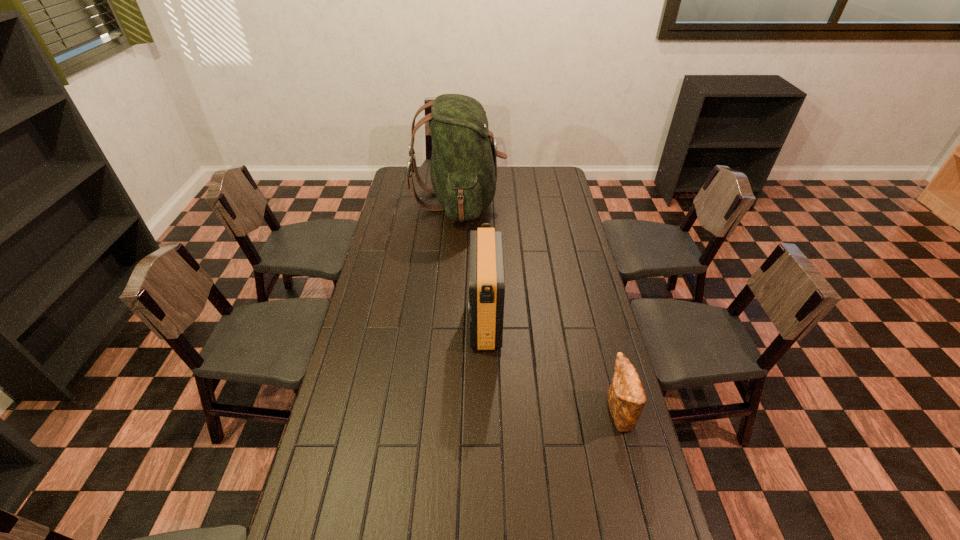
At what (x,y) coordinates should I click in order to perform the action: click on the farthest object. Please return your answer as a coordinate pair (x, y). Looking at the image, I should click on (463, 170).

Locate an element on the screen. the tallest object is located at coordinates (463, 170).

This screenshot has height=540, width=960. Find the location of `radio receiver`. radio receiver is located at coordinates (486, 288).

In order to click on the second nearest object in this screenshot , I will do `click(486, 288)`.

I want to click on the rightmost object, so coord(626,399).

The height and width of the screenshot is (540, 960). I want to click on the shortest object, so click(x=626, y=399).

Where is `vacant area situated 0.220m on the open flap of the backpack`? The height and width of the screenshot is (540, 960). vacant area situated 0.220m on the open flap of the backpack is located at coordinates (549, 201).

The height and width of the screenshot is (540, 960). Identify the location of vacant space located 0.120m on the front-facing side of the radio receiver. (437, 321).

At what (x,y) coordinates should I click in order to perform the action: click on vacant area situated on the front-facing side of the radio receiver. Please return your answer as a coordinate pair (x, y). Looking at the image, I should click on (368, 321).

This screenshot has width=960, height=540. I want to click on vacant region located on the front-facing side of the radio receiver, so click(x=444, y=321).